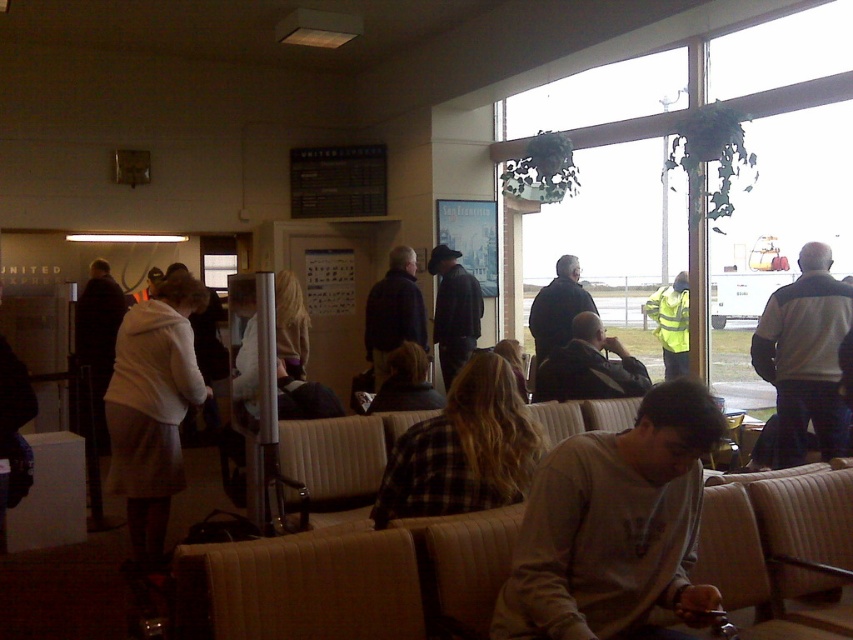
You are a passenger holding a 1.2 meter long carry on luggage. You are standing at the camera position and want to place your luggage on the floor at the point marked as point (177, 417). Can you safely place your luggage there without it being too close to the camera?

The point (177, 417) is 3.85 meters away from the camera. Since the luggage is 1.2 meters long, placing it at that point would leave enough distance from the camera, so it is safe to place the luggage there.